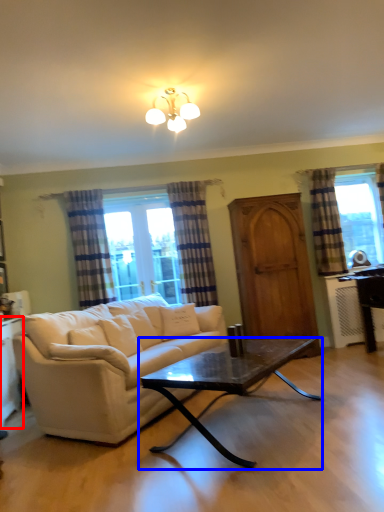
Question: Which object is closer to the camera taking this photo, cabinetry (highlighted by a red box) or coffee table (highlighted by a blue box)?

Choices:
 (A) cabinetry
 (B) coffee table

Answer: (B)